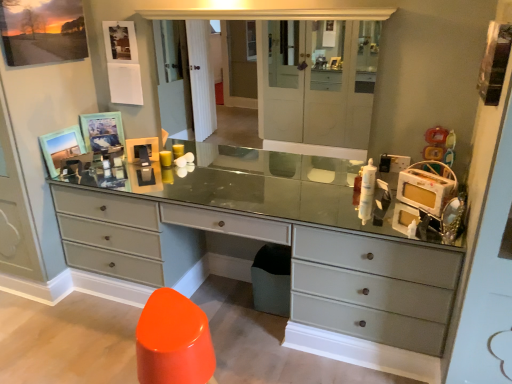
Question: Does matte wooden picture frame at upper left, which appears as the 1th picture frame when ordered from the bottom, have a larger size compared to matte wooden picture frame at upper left, which is the first picture frame in top-to-bottom order?

Choices:
 (A) no
 (B) yes

Answer: (A)

Question: From a real-world perspective, is matte wooden picture frame at upper left, which is the third picture frame from top to bottom, located beneath matte wooden picture frame at upper left, which is the first picture frame in top-to-bottom order?

Choices:
 (A) no
 (B) yes

Answer: (B)

Question: Is matte wooden picture frame at upper left, which appears as the 1th picture frame when ordered from the bottom, oriented away from matte wooden picture frame at upper left, which is the first picture frame in top-to-bottom order?

Choices:
 (A) no
 (B) yes

Answer: (A)

Question: Would you say matte wooden picture frame at upper left, which is the first picture frame in top-to-bottom order, is part of matte wooden picture frame at upper left, which appears as the 1th picture frame when ordered from the bottom,'s contents?

Choices:
 (A) no
 (B) yes

Answer: (A)

Question: Considering the relative positions of matte wooden picture frame at upper left, which appears as the 1th picture frame when ordered from the bottom, and matte wooden picture frame at upper left, which is the first picture frame in top-to-bottom order, in the image provided, is matte wooden picture frame at upper left, which appears as the 1th picture frame when ordered from the bottom, to the left of matte wooden picture frame at upper left, which is the first picture frame in top-to-bottom order, from the viewer's perspective?

Choices:
 (A) no
 (B) yes

Answer: (B)

Question: From a real-world perspective, is matte gray dresser at center positioned above or below wooden picture frame at upper left, which is the second picture frame from top to bottom?

Choices:
 (A) below
 (B) above

Answer: (A)

Question: In terms of size, does matte gray dresser at center appear bigger or smaller than wooden picture frame at upper left, which is the second picture frame from top to bottom?

Choices:
 (A) small
 (B) big

Answer: (B)

Question: Is matte gray dresser at center wider or thinner than wooden picture frame at upper left, marked as the second picture frame in a bottom-to-top arrangement?

Choices:
 (A) thin
 (B) wide

Answer: (B)

Question: From the image's perspective, is matte gray dresser at center located above or below wooden picture frame at upper left, marked as the second picture frame in a bottom-to-top arrangement?

Choices:
 (A) above
 (B) below

Answer: (B)

Question: Considering the positions of plastic yellow toy at upper right and matte wooden picture frame at upper left, which is the first picture frame in top-to-bottom order, in the image, is plastic yellow toy at upper right wider or thinner than matte wooden picture frame at upper left, which is the first picture frame in top-to-bottom order,?

Choices:
 (A) wide
 (B) thin

Answer: (A)

Question: Based on their sizes in the image, would you say plastic yellow toy at upper right is bigger or smaller than matte wooden picture frame at upper left, which is counted as the 3th picture frame, starting from the bottom?

Choices:
 (A) big
 (B) small

Answer: (B)

Question: Is plastic yellow toy at upper right taller or shorter than matte wooden picture frame at upper left, which is counted as the 3th picture frame, starting from the bottom?

Choices:
 (A) tall
 (B) short

Answer: (B)

Question: Does point (428, 150) appear closer or farther from the camera than point (41, 56)?

Choices:
 (A) farther
 (B) closer

Answer: (B)

Question: From a real-world perspective, relative to matte glass medicine cabinet at center, is matte gray dresser at center vertically above or below?

Choices:
 (A) below
 (B) above

Answer: (A)

Question: Considering the positions of matte gray dresser at center and matte glass medicine cabinet at center in the image, is matte gray dresser at center taller or shorter than matte glass medicine cabinet at center?

Choices:
 (A) short
 (B) tall

Answer: (A)